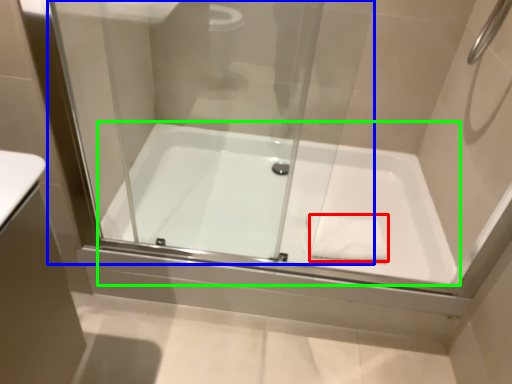
Question: Considering the real-world distances, which object is closest to hand towel (highlighted by a red box)? glass door (highlighted by a blue box) or bathtub (highlighted by a green box).

Choices:
 (A) glass door
 (B) bathtub

Answer: (B)